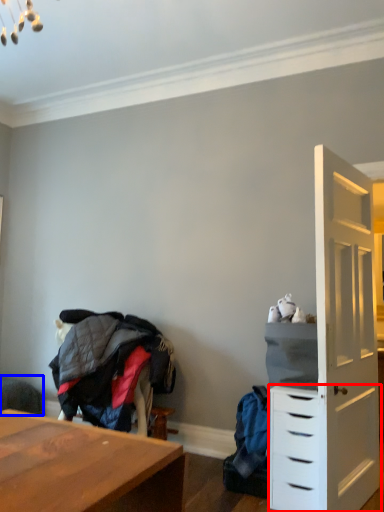
Question: Which point is closer to the camera, chest of drawers (highlighted by a red box) or swivel chair (highlighted by a blue box)?

Choices:
 (A) chest of drawers
 (B) swivel chair

Answer: (A)